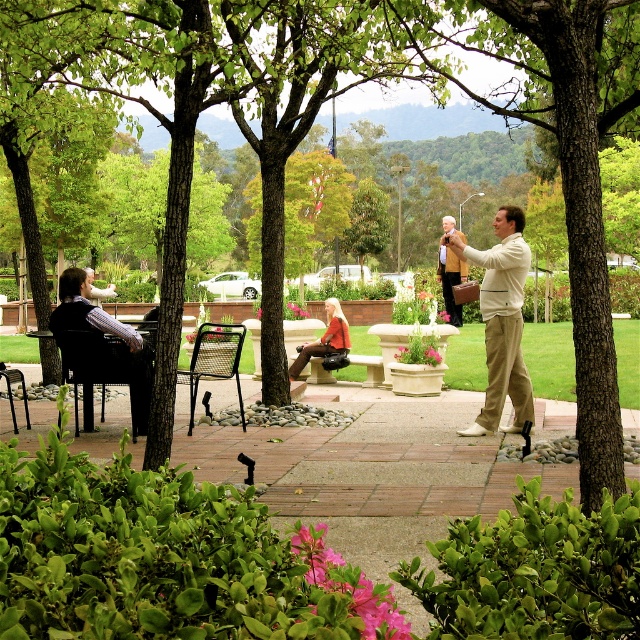
Is point (452, 220) farther from viewer compared to point (10, 381)?

That is True.

You are a GUI agent. You are given a task and a screenshot of the screen. Output one action in this format:
    pyautogui.click(x=<x>, y=<y>)
    Task: Click on the tan leather jacket at center
    This screenshot has height=640, width=640.
    Given the screenshot: What is the action you would take?
    pyautogui.click(x=451, y=272)

Find the location of a particular element. tan leather jacket at center is located at coordinates (451, 272).

Is light beige pants at center above braided wicker chair at center?

Yes.

Is light beige pants at center bigger than braided wicker chair at center?

Correct, light beige pants at center is larger in size than braided wicker chair at center.

Which is in front, point (496, 369) or point (188, 380)?

Positioned in front is point (496, 369).

Identify the location of light beige pants at center. (x=500, y=321).

Can you confirm if light beige pants at center is bigger than leather handbag at center?

Yes, light beige pants at center is bigger than leather handbag at center.

Is point (490, 323) positioned in front of point (333, 333)?

Yes, point (490, 323) is in front of point (333, 333).

You are a GUI agent. You are given a task and a screenshot of the screen. Output one action in this format:
    pyautogui.click(x=<x>, y=<y>)
    Task: Click on the light beige pants at center
    Image resolution: width=640 pixels, height=640 pixels.
    Given the screenshot: What is the action you would take?
    pyautogui.click(x=500, y=321)